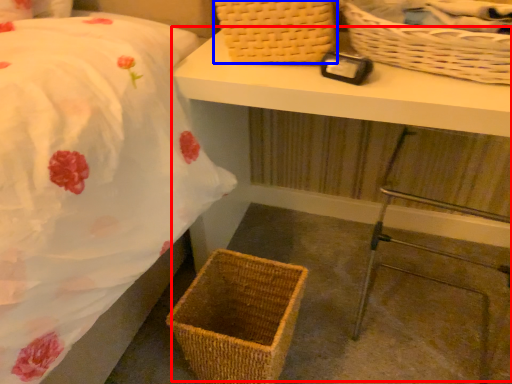
Question: Which point is further to the camera, table (highlighted by a red box) or picnic basket (highlighted by a blue box)?

Choices:
 (A) table
 (B) picnic basket

Answer: (B)